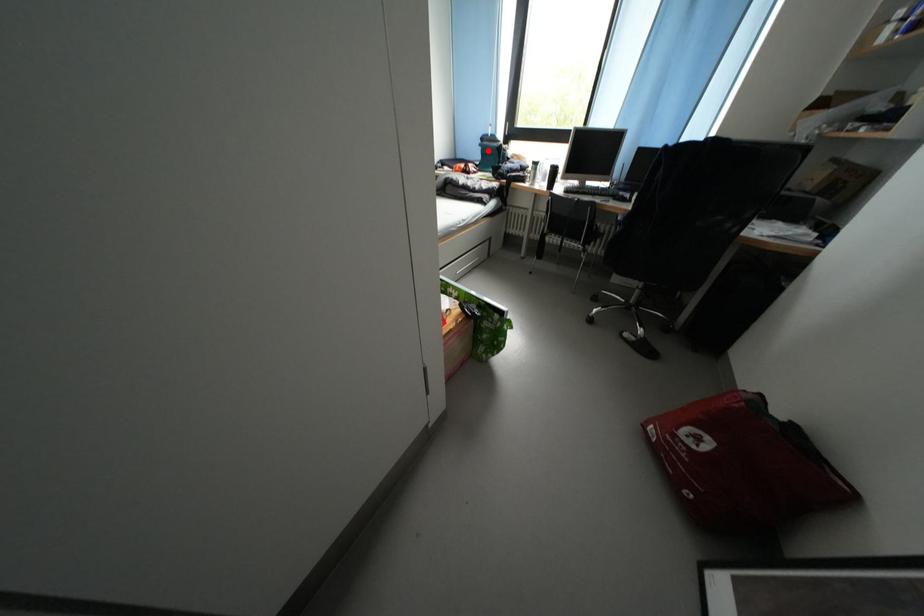
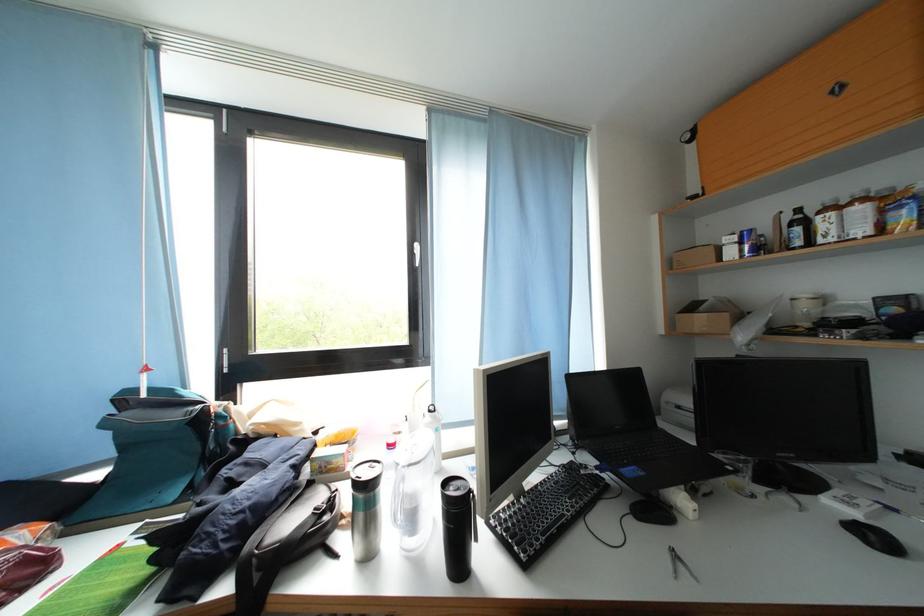
Question: I am providing you with two images of the same scene from different viewpoints. A red point is marked on the first image. Can you still see the location of the red point in image 2?

Choices:
 (A) Yes
 (B) No

Answer: (A)